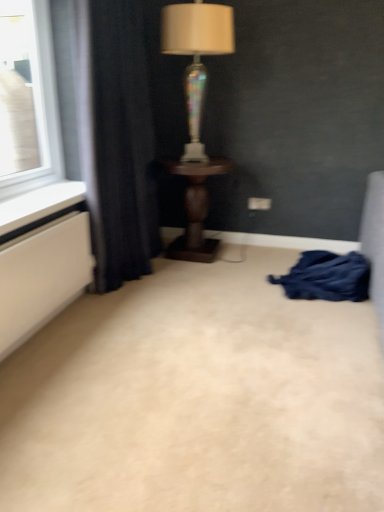
Question: Is dark blue fabric at left to the right of dark blue fabric at lower right from the viewer's perspective?

Choices:
 (A) yes
 (B) no

Answer: (B)

Question: Is dark blue fabric at left next to dark blue fabric at lower right and touching it?

Choices:
 (A) yes
 (B) no

Answer: (B)

Question: Is dark blue fabric at left to the left of dark blue fabric at lower right from the viewer's perspective?

Choices:
 (A) no
 (B) yes

Answer: (B)

Question: From the image's perspective, would you say dark blue fabric at left is positioned over dark blue fabric at lower right?

Choices:
 (A) yes
 (B) no

Answer: (A)

Question: Can you confirm if dark blue fabric at left is taller than dark blue fabric at lower right?

Choices:
 (A) yes
 (B) no

Answer: (A)

Question: From the image's perspective, is beige carpet at center positioned above or below iridescent glass lamp at center?

Choices:
 (A) above
 (B) below

Answer: (B)

Question: Is point (286, 328) closer or farther from the camera than point (196, 95)?

Choices:
 (A) farther
 (B) closer

Answer: (B)

Question: From a real-world perspective, relative to iridescent glass lamp at center, is beige carpet at center vertically above or below?

Choices:
 (A) below
 (B) above

Answer: (A)

Question: Looking at their shapes, would you say beige carpet at center is wider or thinner than iridescent glass lamp at center?

Choices:
 (A) thin
 (B) wide

Answer: (B)

Question: Considering the positions of point (213, 7) and point (264, 480), is point (213, 7) closer or farther from the camera than point (264, 480)?

Choices:
 (A) closer
 (B) farther

Answer: (B)

Question: In terms of width, does iridescent glass lamp at center look wider or thinner when compared to beige carpet at center?

Choices:
 (A) thin
 (B) wide

Answer: (A)

Question: Is iridescent glass lamp at center to the left or to the right of beige carpet at center in the image?

Choices:
 (A) left
 (B) right

Answer: (B)

Question: From a real-world perspective, is iridescent glass lamp at center physically located above or below beige carpet at center?

Choices:
 (A) above
 (B) below

Answer: (A)

Question: From the image's perspective, is dark blue fabric at left positioned above or below dark wood table at center?

Choices:
 (A) below
 (B) above

Answer: (B)

Question: In terms of height, does dark blue fabric at left look taller or shorter compared to dark wood table at center?

Choices:
 (A) tall
 (B) short

Answer: (A)